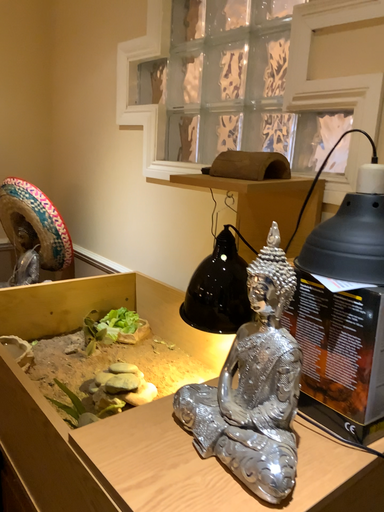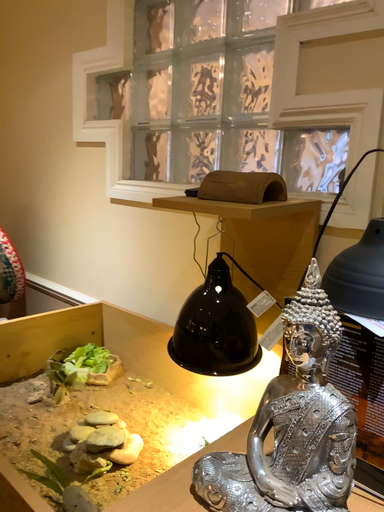
Question: How did the camera likely rotate when shooting the video?

Choices:
 (A) rotated right
 (B) rotated left

Answer: (A)